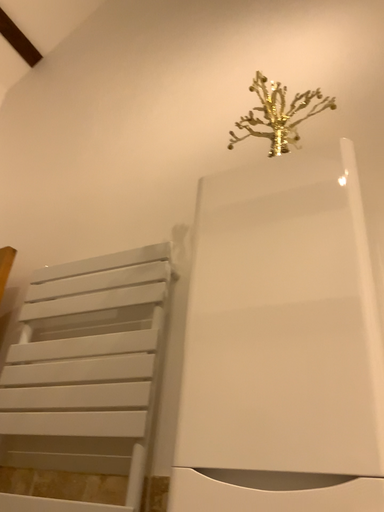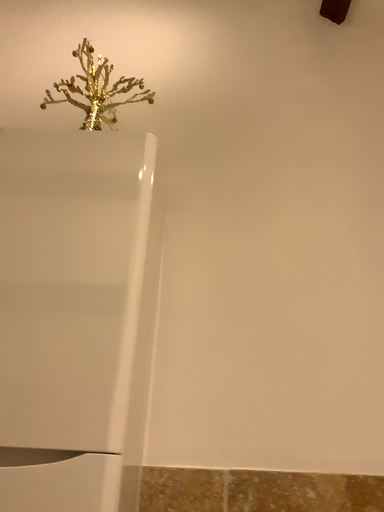
Question: How did the camera likely rotate when shooting the video?

Choices:
 (A) rotated left
 (B) rotated right

Answer: (B)